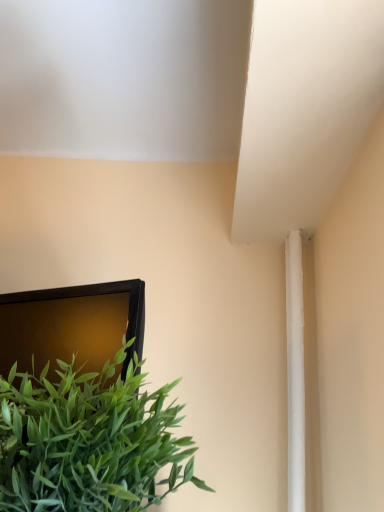
Image resolution: width=384 pixels, height=512 pixels. What do you see at coordinates (88, 441) in the screenshot? I see `green leafy plant at lower left` at bounding box center [88, 441].

The width and height of the screenshot is (384, 512). Find the location of `green leafy plant at lower left`. green leafy plant at lower left is located at coordinates (88, 441).

You are a GUI agent. You are given a task and a screenshot of the screen. Output one action in this format:
    pyautogui.click(x=<x>, y=<y>)
    Task: Click on the green leafy plant at lower left
    This screenshot has height=512, width=384.
    Given the screenshot: What is the action you would take?
    pyautogui.click(x=88, y=441)